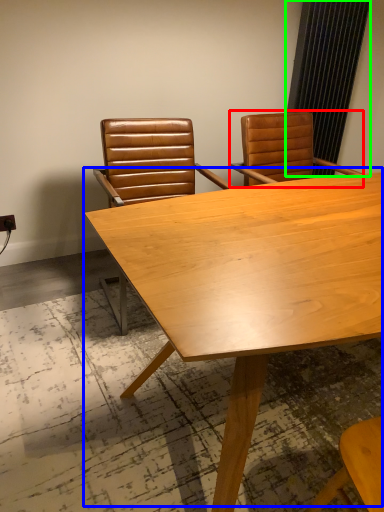
Question: Estimate the real-world distances between objects in this image. Which object is closer to chair (highlighted by a red box), table (highlighted by a blue box) or curtain (highlighted by a green box)?

Choices:
 (A) table
 (B) curtain

Answer: (B)